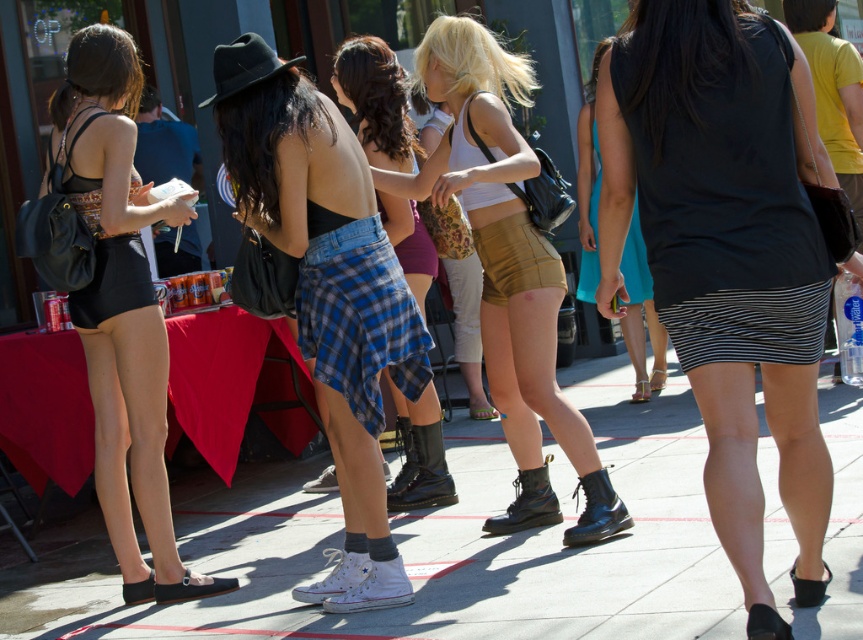
Question: Which is nearer to the black plaid skirt at center?

Choices:
 (A) plaid skirt at center
 (B) white concrete pavement at center

Answer: (A)

Question: Does black matte skirt at center appear over plaid skirt at center?

Choices:
 (A) no
 (B) yes

Answer: (A)

Question: Does black matte shorts at left appear on the right side of gold textured shorts at center?

Choices:
 (A) no
 (B) yes

Answer: (A)

Question: Does black plaid skirt at center appear on the right side of black matte shorts at left?

Choices:
 (A) no
 (B) yes

Answer: (B)

Question: Which of the following is the farthest from the observer?

Choices:
 (A) white concrete pavement at center
 (B) black matte skirt at center

Answer: (A)

Question: Which object is positioned farthest from the black plaid skirt at center?

Choices:
 (A) gold textured shorts at center
 (B) black matte skirt at center
 (C) black matte shorts at left
 (D) white concrete pavement at center

Answer: (D)